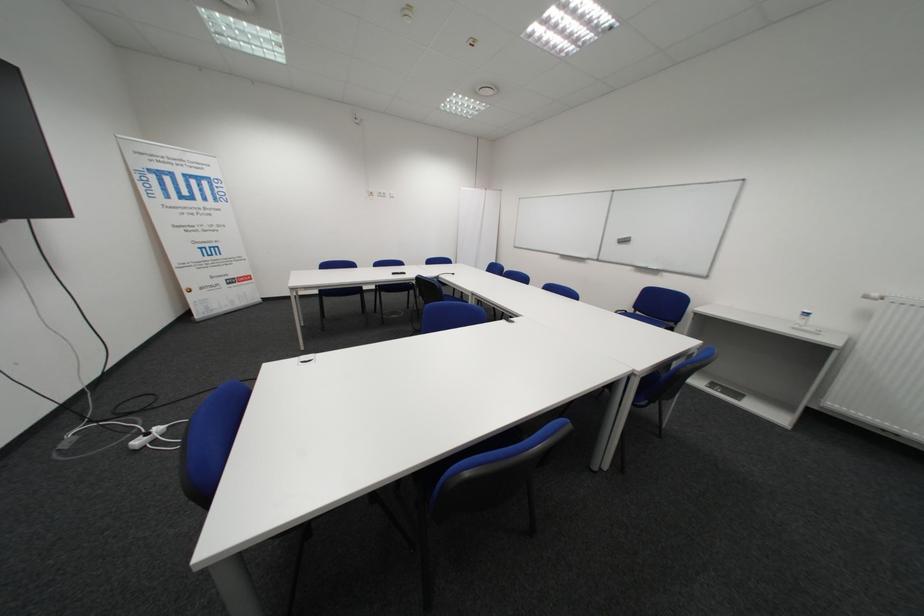
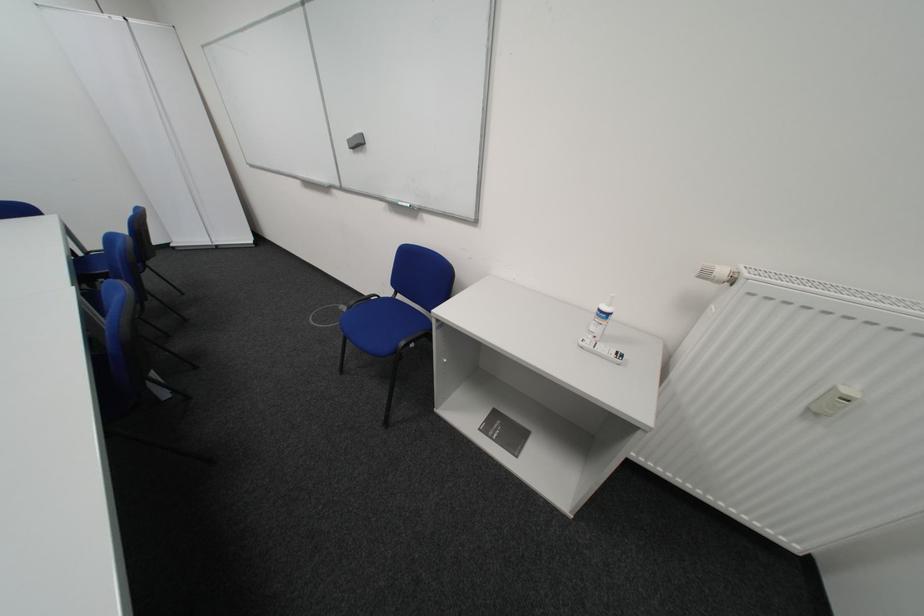
Find the pixel in the second image that matches point 728,392 in the first image.

(504, 439)